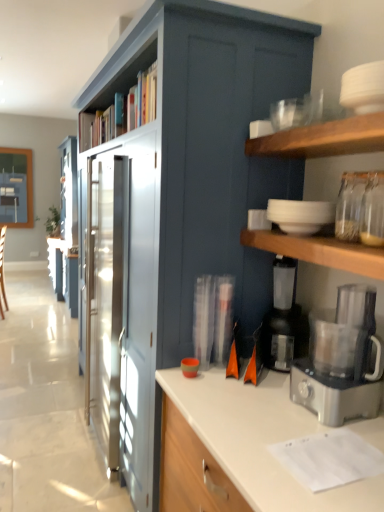
Question: From their relative heights in the image, would you say satin silver food processor at right is taller or shorter than wooden bookshelf at upper center?

Choices:
 (A) tall
 (B) short

Answer: (A)

Question: Considering the positions of satin silver food processor at right and wooden bookshelf at upper center in the image, is satin silver food processor at right wider or thinner than wooden bookshelf at upper center?

Choices:
 (A) wide
 (B) thin

Answer: (B)

Question: Considering the real-world distances, which object is closest to the wooden bookshelf at upper center?

Choices:
 (A) satin silver food processor at right
 (B) black plastic coffee maker at lower right, which is the first appliance from bottom to top
 (C) satin blue cabinet at center
 (D) white matte bowls at upper right, the first appliance when ordered from top to bottom

Answer: (C)

Question: Which of these objects is positioned closest to the black plastic coffee maker at lower right, the second appliance in the top-to-bottom sequence?

Choices:
 (A) wooden bookshelf at upper center
 (B) white matte bowls at upper right, the 2th appliance ordered from the bottom
 (C) satin blue cabinet at center
 (D) satin silver food processor at right

Answer: (D)